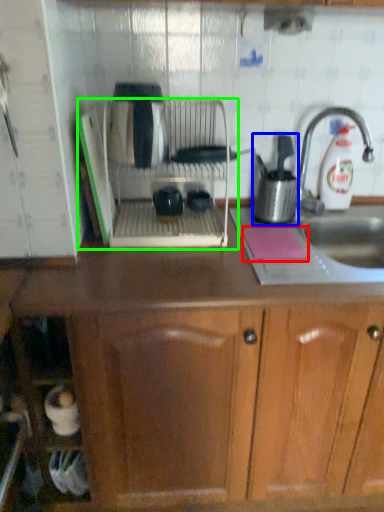
Question: Which object is the farthest from notepad (highlighted by a red box)? Choose among these: kitchen appliance (highlighted by a blue box) or home appliance (highlighted by a green box).

Choices:
 (A) kitchen appliance
 (B) home appliance

Answer: (B)